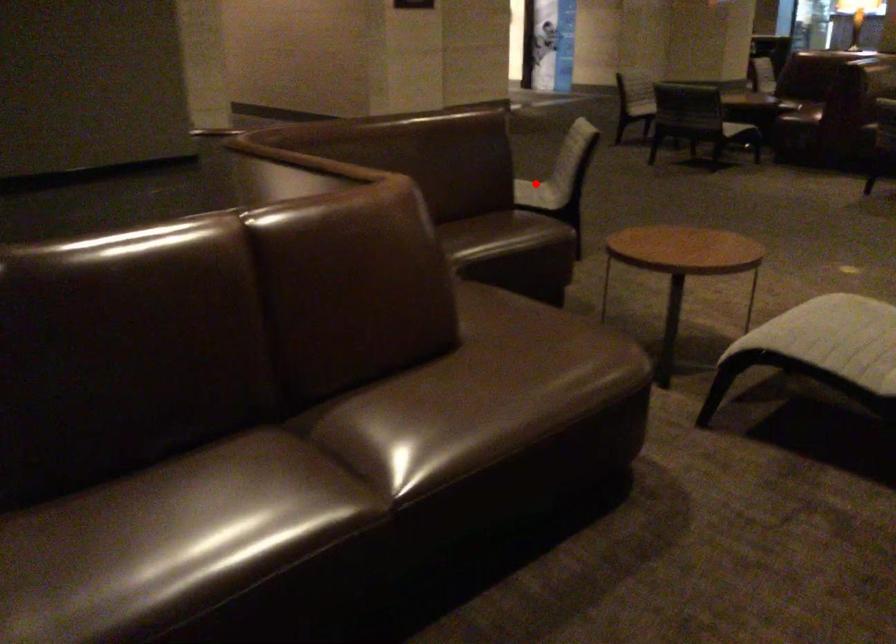
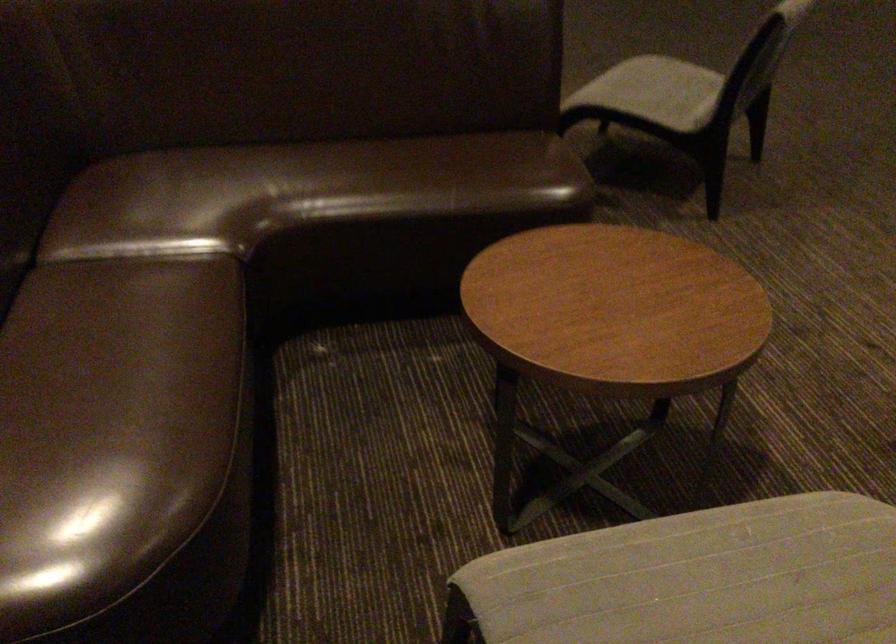
Question: I am providing you with two images of the same scene from different viewpoints. Image1 has a red point marked. In image2, the corresponding 3D location appears at what relative position? Reply with the corresponding letter.

Choices:
 (A) Closer
 (B) Farther

Answer: (A)